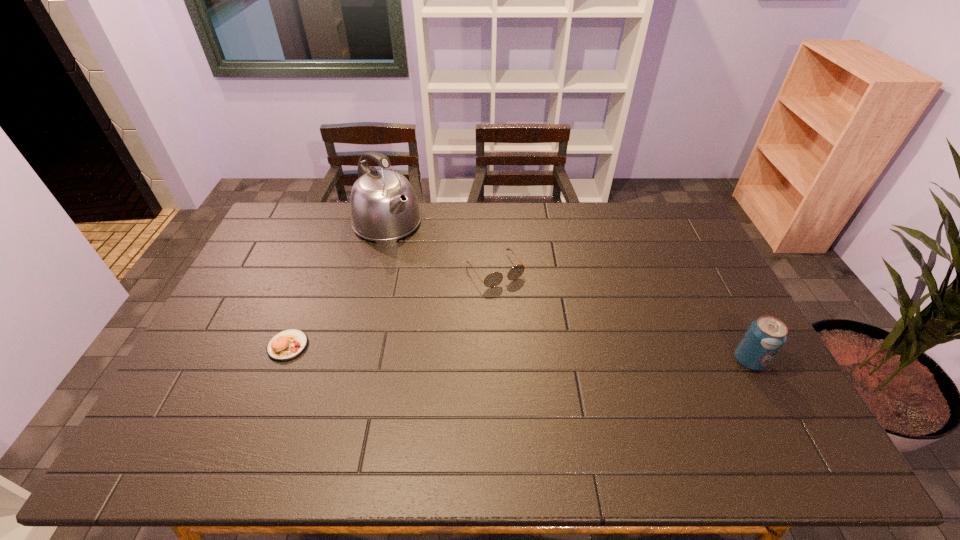
You are a GUI agent. You are given a task and a screenshot of the screen. Output one action in this format:
    pyautogui.click(x=<x>, y=<y>)
    Task: Click on the free space located on the spout of the farthest object
    
    Given the screenshot: What is the action you would take?
    pyautogui.click(x=420, y=256)

Locate an element on the screen. This screenshot has height=540, width=960. vacant area located on the spout of the farthest object is located at coordinates (469, 306).

Image resolution: width=960 pixels, height=540 pixels. I want to click on free space located 0.120m on the spout of the farthest object, so click(422, 260).

Find the location of a particular element. Image resolution: width=960 pixels, height=540 pixels. vacant space situated 0.310m on the lenses of the second farthest object is located at coordinates (561, 361).

Locate an element on the screen. This screenshot has height=540, width=960. vacant position located 0.220m on the lenses of the second farthest object is located at coordinates (543, 338).

Identify the location of vacant region located 0.250m on the lenses of the second farthest object. This screenshot has width=960, height=540. (549, 345).

You are a GUI agent. You are given a task and a screenshot of the screen. Output one action in this format:
    pyautogui.click(x=<x>, y=<y>)
    Task: Click on the object that is at the far edge
    
    Given the screenshot: What is the action you would take?
    pyautogui.click(x=383, y=206)

Locate an element on the screen. object that is at the right edge is located at coordinates (765, 336).

In the image, there is a desktop. Identify the location of vacant space at the far edge. This screenshot has height=540, width=960. (476, 207).

Where is `vacant space at the near edge`? The image size is (960, 540). vacant space at the near edge is located at coordinates (516, 405).